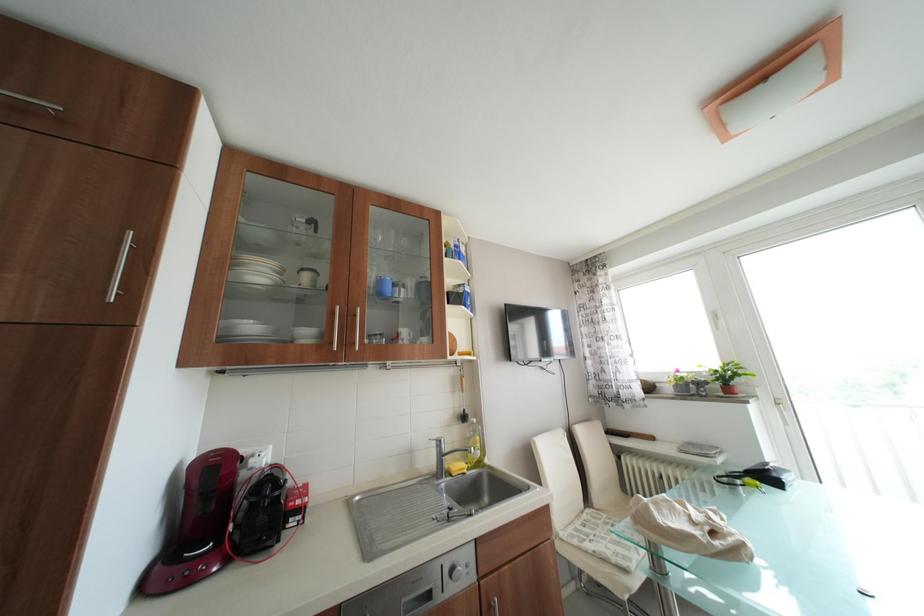
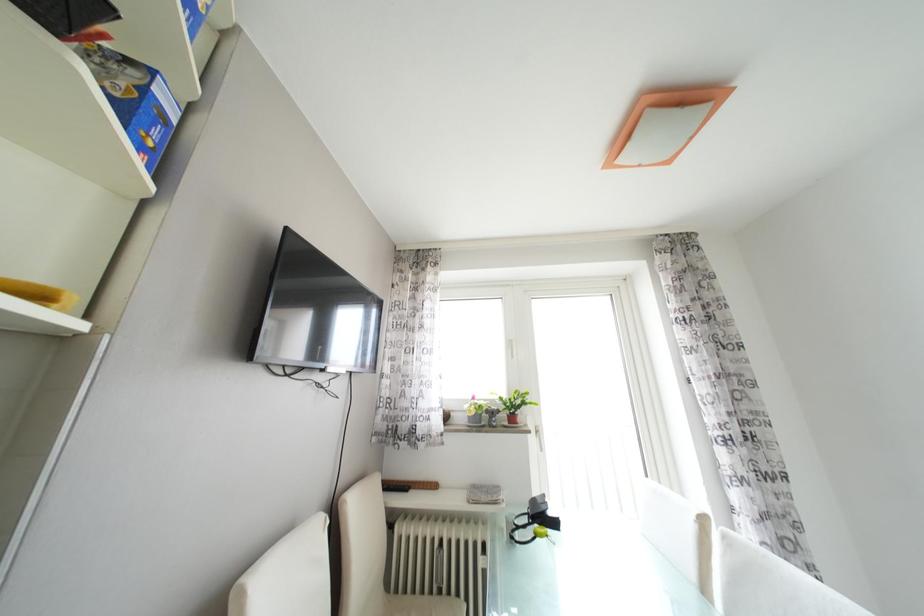
Question: Based on the continuous images, in which direction is the camera rotating? Reply with the corresponding letter.

Choices:
 (A) Left
 (B) Right
 (C) Up
 (D) Down

Answer: (B)